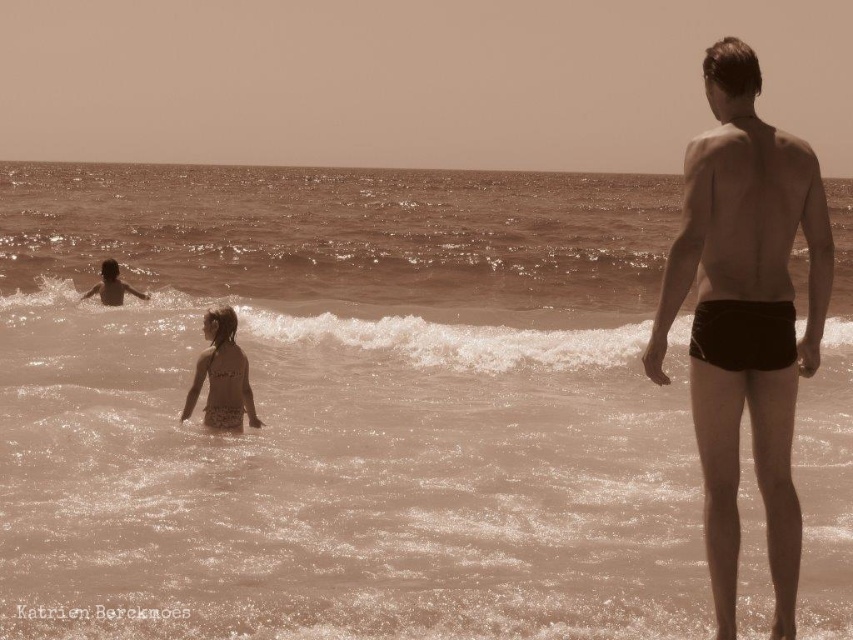
You are a photographer trying to capture the beige textured swimsuit at center in the image. Based on the coordinates provided, where should you focus your camera to ensure the swimsuit is in the center of the frame?

The beige textured swimsuit at center is located at coordinates point (221, 376), so you should focus your camera there to center it in the frame.

You are standing on the beach and see the black matte shorts at right and the beige textured swimsuit at center. Which one is positioned more to the right side of the scene?

The black matte shorts at right are positioned more to the right side of the scene than the beige textured swimsuit at center.

What is the exact coordinate of the black matte shorts at right in the image?

The black matte shorts at right are located at coordinate point (746, 317).